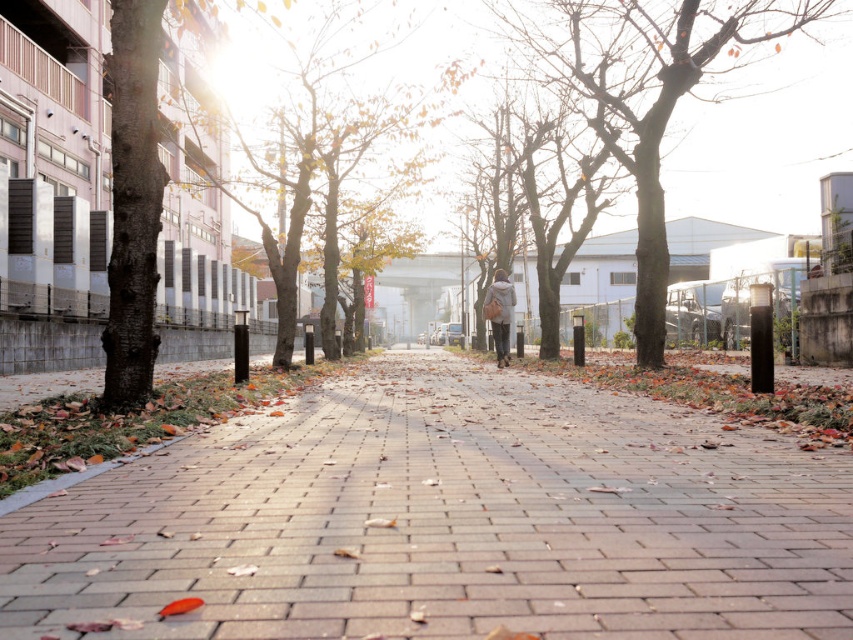
Question: Can you confirm if brick pavement at center is thinner than bare wood tree at center?

Choices:
 (A) no
 (B) yes

Answer: (B)

Question: Which point is closer to the camera?

Choices:
 (A) brick pavement at center
 (B) bare wood tree at center

Answer: (A)

Question: Considering the relative positions of brick pavement at center and bare wood tree at center in the image provided, where is brick pavement at center located with respect to bare wood tree at center?

Choices:
 (A) above
 (B) below

Answer: (B)

Question: Considering the relative positions of brick pavement at center and bare wood tree at center in the image provided, where is brick pavement at center located with respect to bare wood tree at center?

Choices:
 (A) right
 (B) left

Answer: (B)